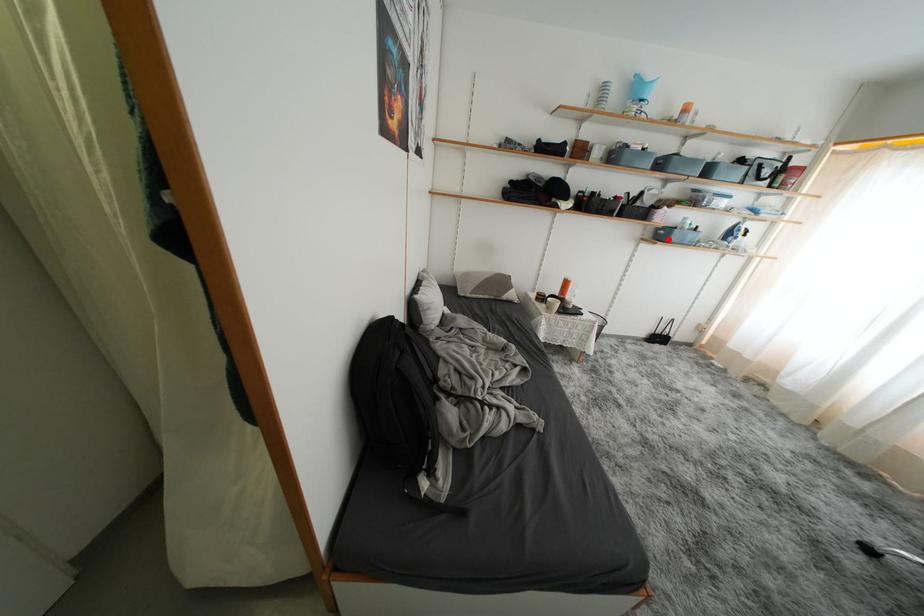
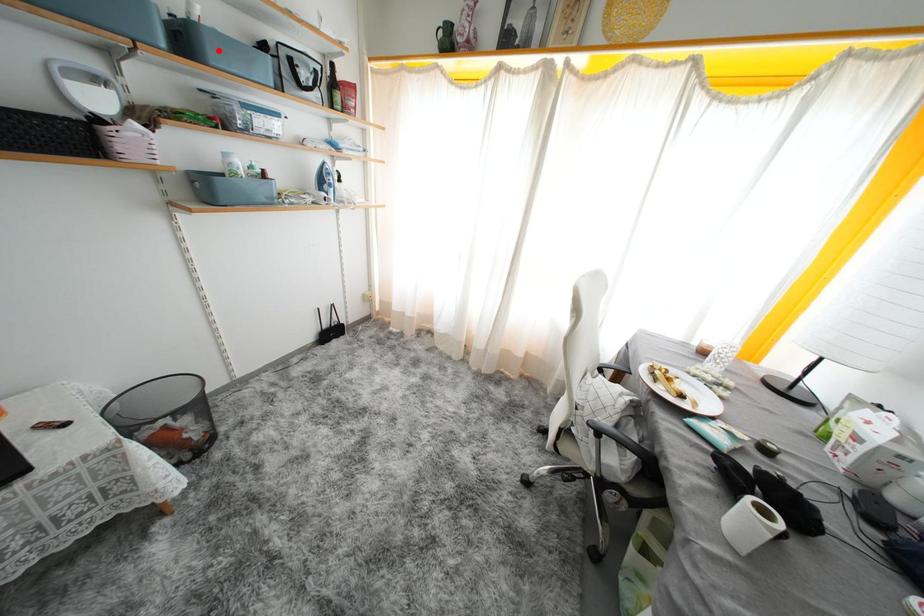
I am providing you with two images of the same scene from different viewpoints. A red point is marked on the first image and another point is marked on the second image. Is the red point in image1 aligned with the point shown in image2?

No